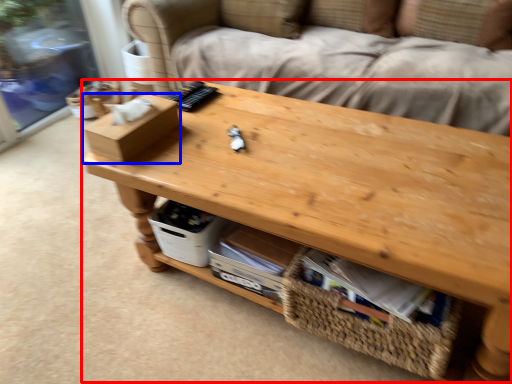
Question: Which of the following is the closest to the observer, table (highlighted by a red box) or box (highlighted by a blue box)?

Choices:
 (A) table
 (B) box

Answer: (A)